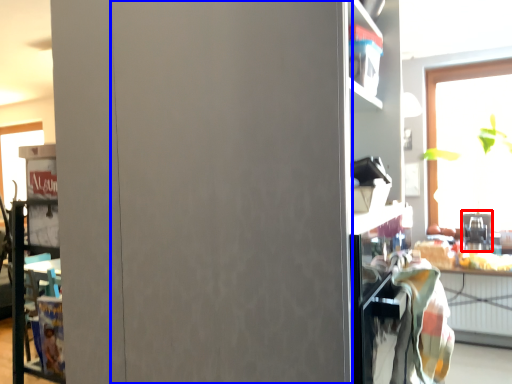
Question: Which of the following is the farthest to the observer, appliance (highlighted by a red box) or garage door (highlighted by a blue box)?

Choices:
 (A) appliance
 (B) garage door

Answer: (A)